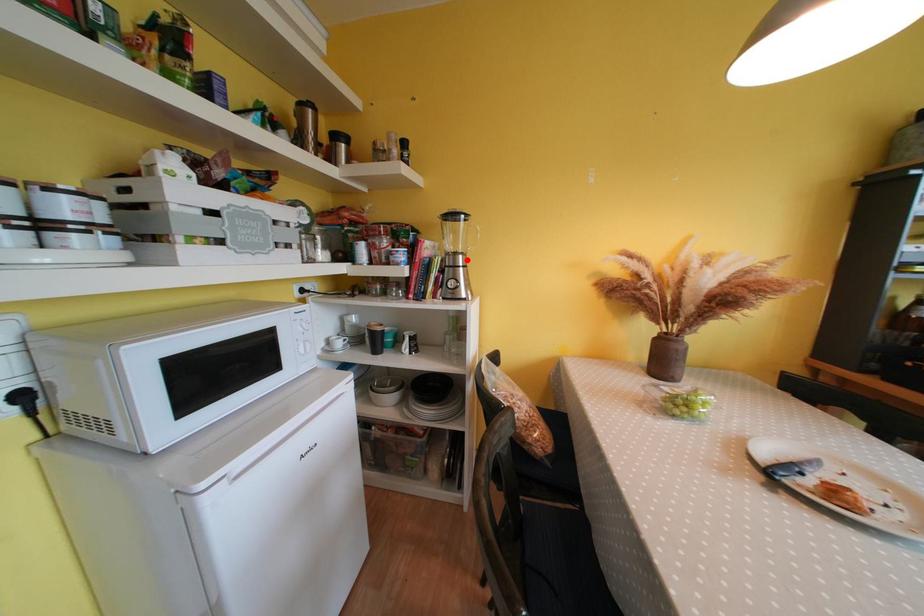
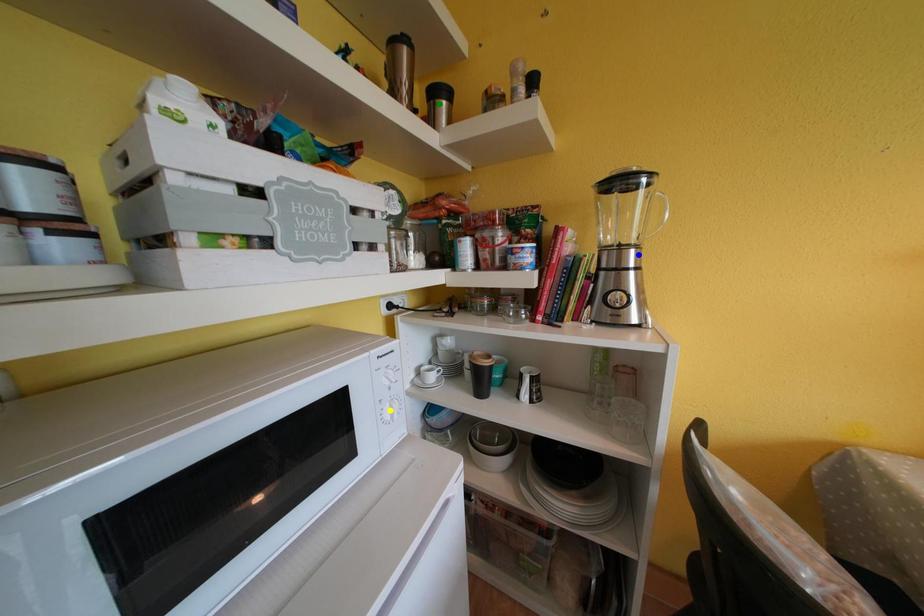
Question: I am providing you with two images of the same scene from different viewpoints. A red point is marked on the first image. You are given multiple points on the second image. Which mark in image 2 goes with the point in image 1?

Choices:
 (A) blue point
 (B) green point
 (C) yellow point

Answer: (A)